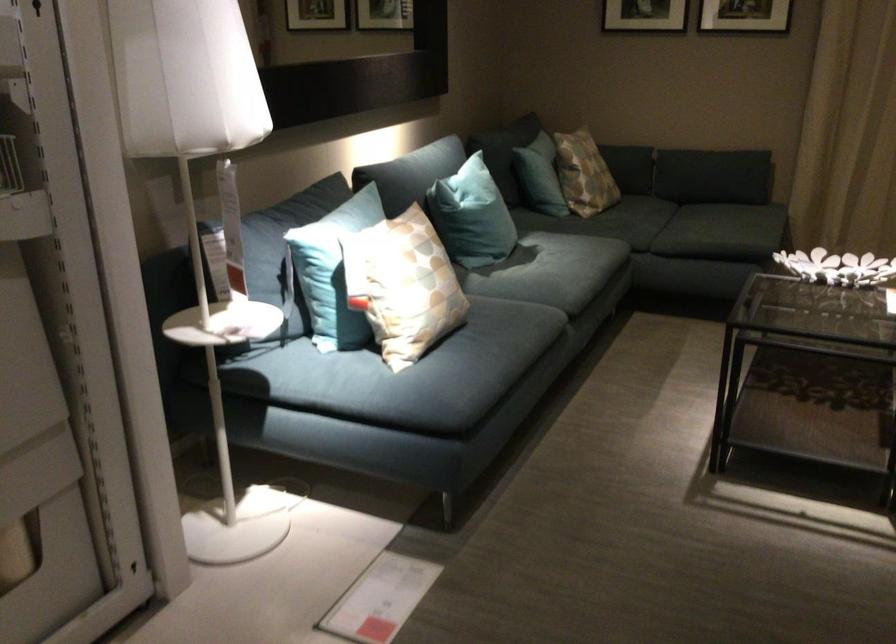
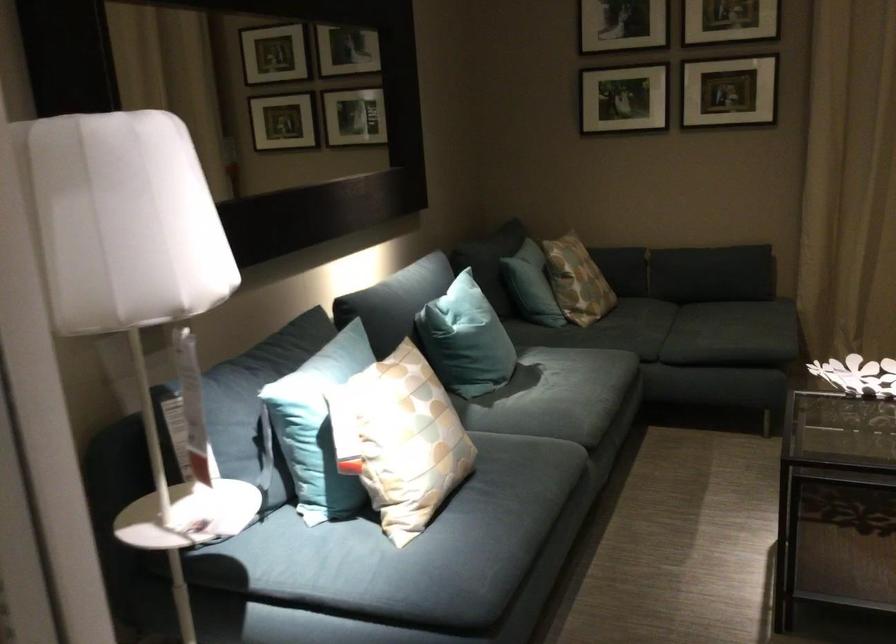
Question: What movement of the cameraman would produce the second image?

Choices:
 (A) Left
 (B) Right
 (C) Forward
 (D) Backward

Answer: (C)